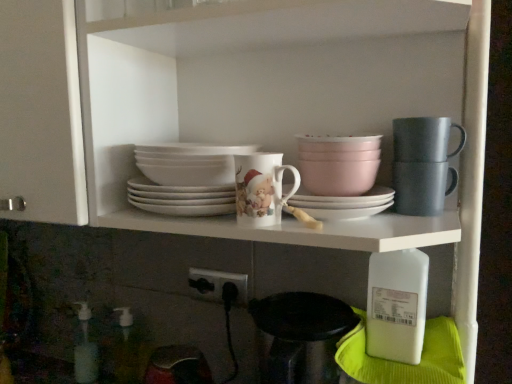
What do you see at coordinates (422, 187) in the screenshot? I see `matte gray mug at upper right` at bounding box center [422, 187].

Locate an element on the screen. translucent plastic soap dispenser at lower left, the second bottle from the left is located at coordinates (126, 347).

Consider the image. What is the approximate width of white plastic bottle at lower right, placed as the 3th bottle when sorted from left to right?

13.96 centimeters.

I want to click on white matte platter at center, so click(x=342, y=199).

Describe the element at coordinates (261, 188) in the screenshot. The height and width of the screenshot is (384, 512). I see `porcelain cup at center` at that location.

At what (x,y) coordinates should I click in order to perform the action: click on matte gray mug at upper right, acting as the second tableware starting from the left. Please return your answer as a coordinate pair (x, y). Looking at the image, I should click on (424, 139).

Identify the location of matte gray mug at upper right. The width and height of the screenshot is (512, 384). (422, 187).

From a real-world perspective, which object stands above the other?

porcelain cup at center, from a real-world perspective.

Could you tell me if white plastic bottle at lower right, which appears as the first bottle when viewed from the front, is turned towards porcelain cup at center?

No, white plastic bottle at lower right, which appears as the first bottle when viewed from the front, does not turn towards porcelain cup at center.

Can you confirm if translucent plastic soap dispenser at lower left, the second bottle from the left, is taller than pink matte bowl at upper center, acting as the 1th tableware starting from the left?

Yes, translucent plastic soap dispenser at lower left, the second bottle from the left, is taller than pink matte bowl at upper center, acting as the 1th tableware starting from the left.

Where is `the 2nd bottle positioned below the pink matte bowl at upper center, which is the 2th tableware from right to left (from a real-world perspective)`? the 2nd bottle positioned below the pink matte bowl at upper center, which is the 2th tableware from right to left (from a real-world perspective) is located at coordinates (126, 347).

Does translucent plastic soap dispenser at lower left, which is the 2th bottle in right-to-left order, have a larger size compared to pink matte bowl at upper center, which is the 2th tableware from right to left?

No, translucent plastic soap dispenser at lower left, which is the 2th bottle in right-to-left order, is not bigger than pink matte bowl at upper center, which is the 2th tableware from right to left.

Which is more to the right, translucent plastic soap dispenser at lower left, marked as the second bottle in a front-to-back arrangement, or pink matte bowl at upper center, acting as the 1th tableware starting from the left?

pink matte bowl at upper center, acting as the 1th tableware starting from the left.

Does matte gray mug at upper right, acting as the second tableware starting from the left, have a greater height compared to translucent plastic bottle at lower left, placed as the first bottle when sorted from left to right?

Incorrect, the height of matte gray mug at upper right, acting as the second tableware starting from the left, is not larger of that of translucent plastic bottle at lower left, placed as the first bottle when sorted from left to right.

Is matte gray mug at upper right, acting as the second tableware starting from the left, smaller than translucent plastic bottle at lower left, placed as the first bottle when sorted from left to right?

Yes, matte gray mug at upper right, acting as the second tableware starting from the left, is smaller than translucent plastic bottle at lower left, placed as the first bottle when sorted from left to right.

Consider the image. From the image's perspective, is matte gray mug at upper right, acting as the second tableware starting from the left, above or below translucent plastic bottle at lower left, which is the first bottle in back-to-front order?

matte gray mug at upper right, acting as the second tableware starting from the left, is situated higher than translucent plastic bottle at lower left, which is the first bottle in back-to-front order, in the image.

Considering the points (412, 161) and (80, 361), which point is behind, point (412, 161) or point (80, 361)?

The point (80, 361) is behind.

Which is nearer, (x=364, y=141) or (x=393, y=144)?

The point (x=364, y=141) is more forward.

How different are the orientations of pink matte bowl at upper center, which is the 2th tableware from right to left, and matte gray mug at upper right, acting as the second tableware starting from the left, in degrees?

There is a 1.03-degree angle between the facing directions of pink matte bowl at upper center, which is the 2th tableware from right to left, and matte gray mug at upper right, acting as the second tableware starting from the left.

Is pink matte bowl at upper center, acting as the 1th tableware starting from the left, touching matte gray mug at upper right, acting as the second tableware starting from the left?

Yes, pink matte bowl at upper center, acting as the 1th tableware starting from the left, is with matte gray mug at upper right, acting as the second tableware starting from the left.

Considering the relative positions of pink matte bowl at upper center, which is the 2th tableware from right to left, and matte gray mug at upper right, arranged as the first tableware when viewed from the right, in the image provided, is pink matte bowl at upper center, which is the 2th tableware from right to left, to the right of matte gray mug at upper right, arranged as the first tableware when viewed from the right, from the viewer's perspective?

Incorrect, pink matte bowl at upper center, which is the 2th tableware from right to left, is not on the right side of matte gray mug at upper right, arranged as the first tableware when viewed from the right.

Is white plastic bottle at lower right, which is the third bottle in back-to-front order, outside of translucent plastic bottle at lower left, which is the first bottle in back-to-front order?

white plastic bottle at lower right, which is the third bottle in back-to-front order, is positioned outside translucent plastic bottle at lower left, which is the first bottle in back-to-front order.

Is white plastic bottle at lower right, marked as the first bottle in a right-to-left arrangement, oriented away from translucent plastic bottle at lower left, which is the first bottle in back-to-front order?

No, white plastic bottle at lower right, marked as the first bottle in a right-to-left arrangement, is not facing away from translucent plastic bottle at lower left, which is the first bottle in back-to-front order.

Between white plastic bottle at lower right, which is the third bottle in back-to-front order, and translucent plastic bottle at lower left, which is the first bottle in back-to-front order, which one has larger size?

Bigger between the two is white plastic bottle at lower right, which is the third bottle in back-to-front order.

Is white plastic bottle at lower right, placed as the 3th bottle when sorted from left to right, wider or thinner than translucent plastic bottle at lower left, placed as the first bottle when sorted from left to right?

white plastic bottle at lower right, placed as the 3th bottle when sorted from left to right, is wider than translucent plastic bottle at lower left, placed as the first bottle when sorted from left to right.

Does porcelain cup at center have a lesser height compared to translucent plastic bottle at lower left, which is the first bottle in back-to-front order?

Correct, porcelain cup at center is not as tall as translucent plastic bottle at lower left, which is the first bottle in back-to-front order.

Which object is positioned more to the left, porcelain cup at center or translucent plastic bottle at lower left, which is counted as the 3th bottle, starting from the front?

translucent plastic bottle at lower left, which is counted as the 3th bottle, starting from the front.

Considering the positions of objects porcelain cup at center and translucent plastic bottle at lower left, which is the first bottle in back-to-front order, in the image provided, who is behind, porcelain cup at center or translucent plastic bottle at lower left, which is the first bottle in back-to-front order,?

translucent plastic bottle at lower left, which is the first bottle in back-to-front order, is more distant.

Is porcelain cup at center surrounding translucent plastic bottle at lower left, positioned as the third bottle in right-to-left order?

That's incorrect, translucent plastic bottle at lower left, positioned as the third bottle in right-to-left order, is not inside porcelain cup at center.

Which is less distant, (121, 332) or (78, 360)?

The point (78, 360) is closer.

Is translucent plastic soap dispenser at lower left, which ranks as the 2th bottle in back-to-front order, oriented towards translucent plastic bottle at lower left, which is the first bottle in back-to-front order?

No.

Image resolution: width=512 pixels, height=384 pixels. Find the location of `bottle that is the 1st one when counting rightward from the translucent plastic bottle at lower left, which is the first bottle in back-to-front order`. bottle that is the 1st one when counting rightward from the translucent plastic bottle at lower left, which is the first bottle in back-to-front order is located at coordinates (126, 347).

Is translucent plastic soap dispenser at lower left, the second bottle from the left, directly adjacent to translucent plastic bottle at lower left, which is the first bottle in back-to-front order?

Yes, the surface of translucent plastic soap dispenser at lower left, the second bottle from the left, is in contact with translucent plastic bottle at lower left, which is the first bottle in back-to-front order.

Locate an element on the screen. This screenshot has height=384, width=512. coffee cup above the white plastic bottle at lower right, placed as the 3th bottle when sorted from left to right (from the image's perspective) is located at coordinates (261, 188).

Identify the location of the 1st bottle counting from the left of the pink matte bowl at upper center, which is the 2th tableware from right to left. (126, 347).

Which object lies nearer to the anchor point porcelain cup at center, translucent plastic bottle at lower left, which is the first bottle in back-to-front order, or matte gray mug at upper right?

matte gray mug at upper right.

Which object lies nearer to the anchor point pink matte bowl at upper center, which is the 2th tableware from right to left, matte gray mug at upper right, arranged as the first tableware when viewed from the right, or white plastic bottle at lower right, which is the third bottle in back-to-front order?

matte gray mug at upper right, arranged as the first tableware when viewed from the right, lies closer to pink matte bowl at upper center, which is the 2th tableware from right to left, than the other object.

Based on their spatial positions, is white plastic bottle at lower right, marked as the first bottle in a right-to-left arrangement, or matte gray mug at upper right closer to porcelain cup at center?

The object closer to porcelain cup at center is matte gray mug at upper right.

From the picture: When comparing their distances from matte gray mug at upper right, arranged as the first tableware when viewed from the right, does matte gray mug at upper right or porcelain cup at center seem further?

porcelain cup at center lies further to matte gray mug at upper right, arranged as the first tableware when viewed from the right, than the other object.

Which object lies further to the anchor point translucent plastic bottle at lower left, placed as the first bottle when sorted from left to right, translucent plastic soap dispenser at lower left, marked as the second bottle in a front-to-back arrangement, or pink matte bowl at upper center, which is the 2th tableware from right to left?

pink matte bowl at upper center, which is the 2th tableware from right to left, is positioned further to the anchor translucent plastic bottle at lower left, placed as the first bottle when sorted from left to right.

In the scene shown: From the image, which object appears to be farther from porcelain cup at center, matte gray mug at upper right or translucent plastic bottle at lower left, placed as the first bottle when sorted from left to right?

translucent plastic bottle at lower left, placed as the first bottle when sorted from left to right, is positioned further to the anchor porcelain cup at center.

From the image, which object appears to be farther from porcelain cup at center, translucent plastic bottle at lower left, which is counted as the 3th bottle, starting from the front, or white plastic bottle at lower right, placed as the 3th bottle when sorted from left to right?

The object further to porcelain cup at center is translucent plastic bottle at lower left, which is counted as the 3th bottle, starting from the front.

Looking at the image, which one is located further to pink matte bowl at upper center, acting as the 1th tableware starting from the left, porcelain cup at center or matte gray mug at upper right?

Among the two, porcelain cup at center is located further to pink matte bowl at upper center, acting as the 1th tableware starting from the left.

At what (x,y) coordinates should I click in order to perform the action: click on platter between translucent plastic bottle at lower left, placed as the first bottle when sorted from left to right, and white plastic bottle at lower right, marked as the first bottle in a right-to-left arrangement, in the horizontal direction. Please return your answer as a coordinate pair (x, y). The width and height of the screenshot is (512, 384). Looking at the image, I should click on (342, 199).

You are a GUI agent. You are given a task and a screenshot of the screen. Output one action in this format:
    pyautogui.click(x=<x>, y=<y>)
    Task: Click on the coffee cup located between translucent plastic soap dispenser at lower left, the second bottle from the left, and pink matte bowl at upper center, which is the 2th tableware from right to left, in the left-right direction
    The width and height of the screenshot is (512, 384).
    Given the screenshot: What is the action you would take?
    pyautogui.click(x=261, y=188)

Image resolution: width=512 pixels, height=384 pixels. What are the coordinates of `platter between porcelain cup at center and matte gray mug at upper right` in the screenshot? It's located at (342, 199).

Where is `coffee cup located between translucent plastic bottle at lower left, placed as the first bottle when sorted from left to right, and matte gray mug at upper right in the left-right direction`? The height and width of the screenshot is (384, 512). coffee cup located between translucent plastic bottle at lower left, placed as the first bottle when sorted from left to right, and matte gray mug at upper right in the left-right direction is located at coordinates (261, 188).